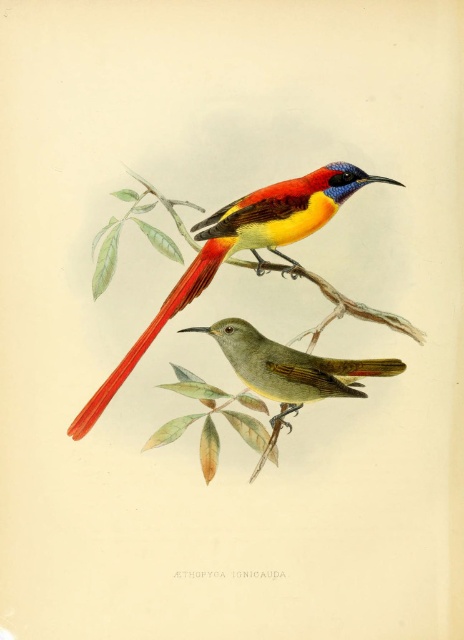
Is point (255, 248) closer to viewer compared to point (274, 417)?

No, (255, 248) is further to viewer.

Does shiny red bird at upper center appear under yellow-green glossy bird at center?

Actually, shiny red bird at upper center is above yellow-green glossy bird at center.

Is point (310, 179) closer to viewer compared to point (324, 356)?

Yes.

This screenshot has height=640, width=464. Identify the location of shiny red bird at upper center. (239, 250).